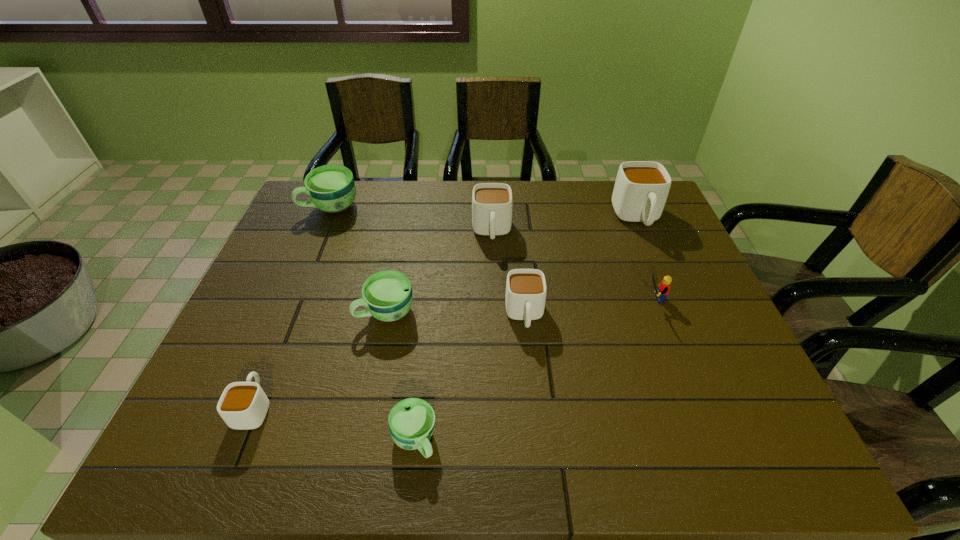
Find the location of `vacant point at the left edge`. vacant point at the left edge is located at coordinates (267, 306).

Locate an element on the screen. vacant space at the right edge of the desktop is located at coordinates (660, 280).

Where is `free region at the near left corner of the desktop`? Image resolution: width=960 pixels, height=540 pixels. free region at the near left corner of the desktop is located at coordinates (185, 443).

Where is `vacant space at the far right corner of the desktop`? vacant space at the far right corner of the desktop is located at coordinates (669, 219).

The image size is (960, 540). What are the coordinates of `free space between the second nearest blue cup and the leftmost blue cup` in the screenshot? It's located at (359, 259).

This screenshot has width=960, height=540. Find the location of `vacant area that lies between the second nearest blue cup and the second biggest white cup`. vacant area that lies between the second nearest blue cup and the second biggest white cup is located at coordinates (439, 272).

Where is `free space that is in between the third biggest white cup and the smallest white cup`? free space that is in between the third biggest white cup and the smallest white cup is located at coordinates (390, 361).

Image resolution: width=960 pixels, height=540 pixels. Find the location of `vacant area between the smallest blue cup and the biggest blue cup`. vacant area between the smallest blue cup and the biggest blue cup is located at coordinates (372, 323).

Where is `vacant area between the third farthest white cup and the Lego`? Image resolution: width=960 pixels, height=540 pixels. vacant area between the third farthest white cup and the Lego is located at coordinates (588, 307).

You are a GUI agent. You are given a task and a screenshot of the screen. Output one action in this format:
    pyautogui.click(x=<x>, y=<y>)
    Task: Click on the free point between the second biggest white cup and the yellow Lego
    The width and height of the screenshot is (960, 540).
    Given the screenshot: What is the action you would take?
    pyautogui.click(x=571, y=266)